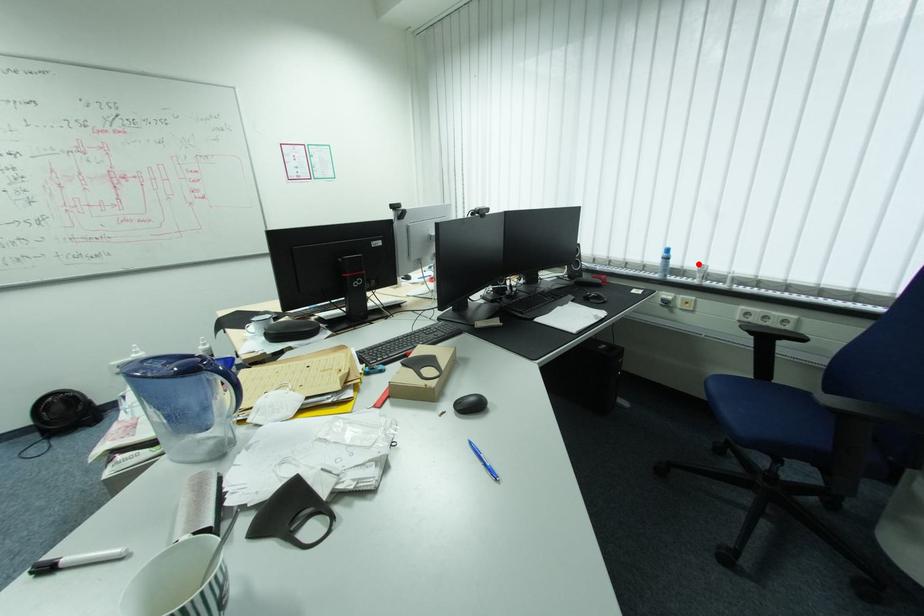
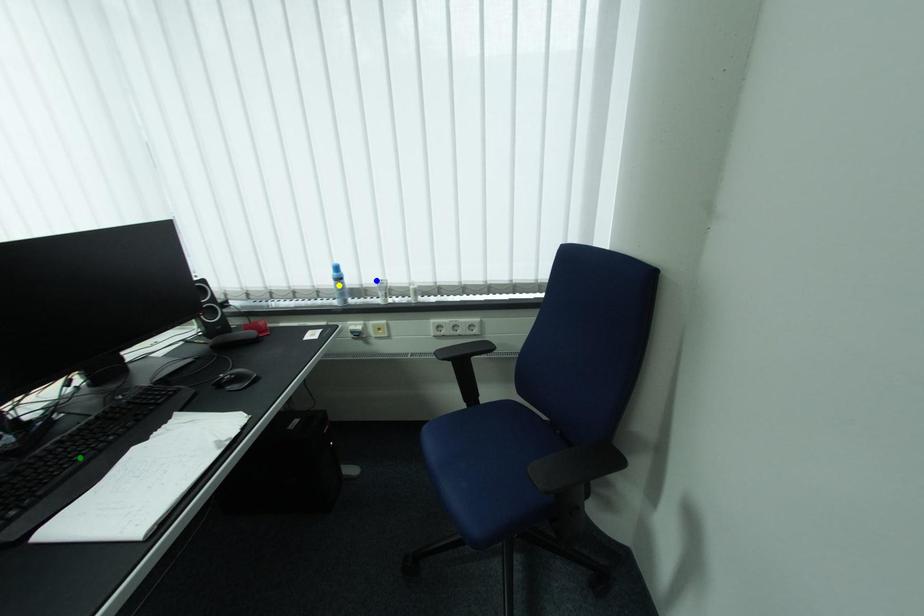
Question: I am providing you with two images of the same scene from different viewpoints. A red point is marked on the first image. You are given multiple points on the second image. Which mark in image 2 goes with the point in image 1?

Choices:
 (A) green point
 (B) blue point
 (C) yellow point

Answer: (B)